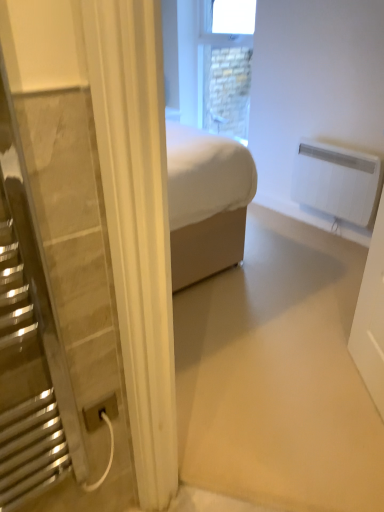
In order to click on free spot below white plastic radiator at upper right (from a real-world perspective) in this screenshot , I will do `click(319, 241)`.